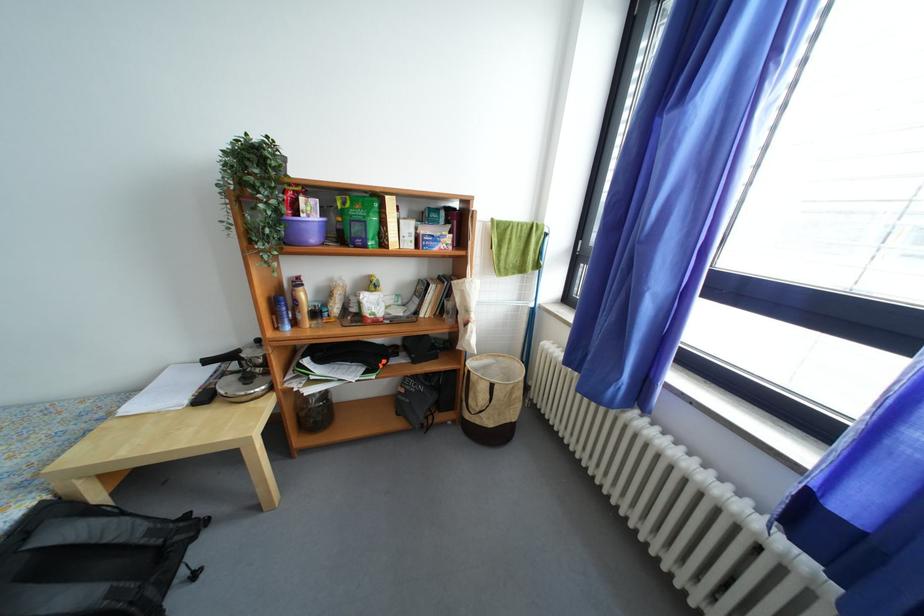
Locate an element on the screen. Image resolution: width=924 pixels, height=616 pixels. small glass jar is located at coordinates (314, 314).